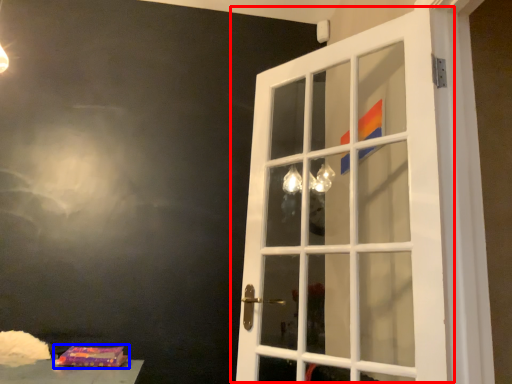
Question: Which point is closer to the camera, door (highlighted by a red box) or package (highlighted by a blue box)?

Choices:
 (A) door
 (B) package

Answer: (A)